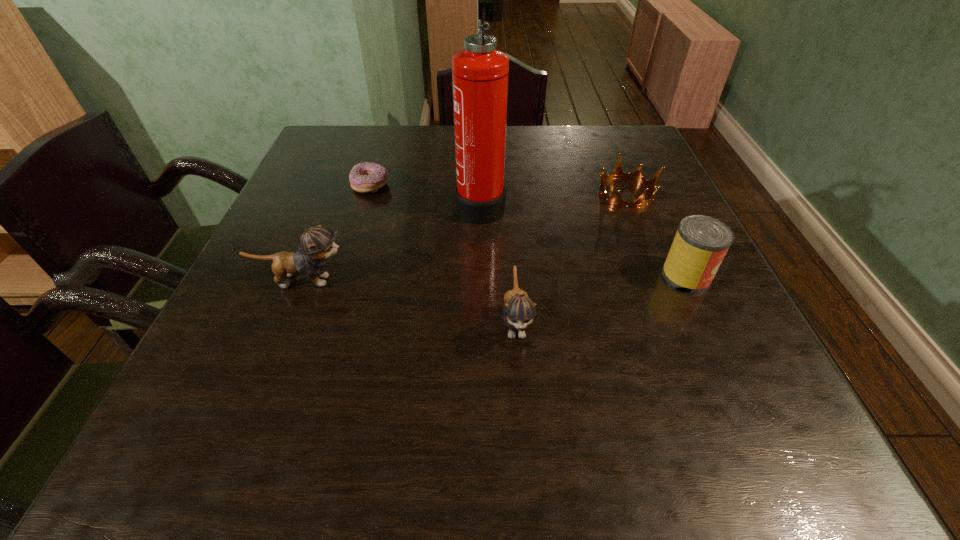
Identify the location of the left kitten. The width and height of the screenshot is (960, 540). click(317, 244).

Find the location of a particular element. The height and width of the screenshot is (540, 960). the right kitten is located at coordinates (519, 310).

Locate an element on the screen. The image size is (960, 540). crown is located at coordinates (617, 200).

Where is `fire extinguisher`? The height and width of the screenshot is (540, 960). fire extinguisher is located at coordinates coord(480,72).

At what (x,y) coordinates should I click in order to perform the action: click on doughnut. Please return your answer as a coordinate pair (x, y). Looking at the image, I should click on (365, 177).

Find the location of `can`. can is located at coordinates (701, 242).

Locate an element on the screen. free space located 0.110m on the front-facing side of the left kitten is located at coordinates (406, 281).

This screenshot has height=540, width=960. I want to click on vacant region located 0.340m on the left of the second shortest object, so click(x=456, y=193).

Where is `blank space located 0.210m on the front-facing side of the tallest object`? Image resolution: width=960 pixels, height=540 pixels. blank space located 0.210m on the front-facing side of the tallest object is located at coordinates (368, 204).

Image resolution: width=960 pixels, height=540 pixels. I want to click on blank area located 0.100m on the front-facing side of the tallest object, so click(414, 204).